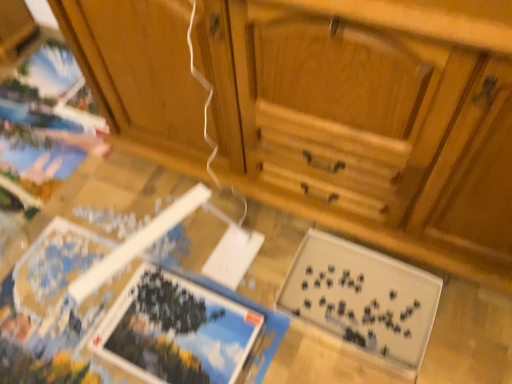
Question: From a real-world perspective, is black matte puzzle pieces at lower right, which ranks as the second magazine in left-to-right order, beneath wooden cabinet at center?

Choices:
 (A) yes
 (B) no

Answer: (A)

Question: Is black matte puzzle pieces at lower right, which ranks as the second magazine in left-to-right order, facing towards wooden cabinet at center?

Choices:
 (A) yes
 (B) no

Answer: (B)

Question: From the image's perspective, is black matte puzzle pieces at lower right, which is counted as the 1th magazine, starting from the right, on top of wooden cabinet at center?

Choices:
 (A) yes
 (B) no

Answer: (B)

Question: Can you confirm if black matte puzzle pieces at lower right, which ranks as the second magazine in left-to-right order, is smaller than wooden cabinet at center?

Choices:
 (A) yes
 (B) no

Answer: (A)

Question: Is black matte puzzle pieces at lower right, which ranks as the second magazine in left-to-right order, taller than wooden cabinet at center?

Choices:
 (A) yes
 (B) no

Answer: (B)

Question: Considering the positions of point (86, 206) and point (350, 137), is point (86, 206) closer or farther from the camera than point (350, 137)?

Choices:
 (A) closer
 (B) farther

Answer: (B)

Question: Based on their positions, is wooden puzzle pieces at lower center located to the left or right of wooden cabinet at center?

Choices:
 (A) right
 (B) left

Answer: (B)

Question: From their relative heights in the image, would you say wooden puzzle pieces at lower center is taller or shorter than wooden cabinet at center?

Choices:
 (A) short
 (B) tall

Answer: (A)

Question: From the image's perspective, is wooden puzzle pieces at lower center above or below wooden cabinet at center?

Choices:
 (A) below
 (B) above

Answer: (A)

Question: In the image, is wooden cabinet at center positioned in front of or behind black matte puzzle pieces at lower right, which ranks as the second magazine in left-to-right order?

Choices:
 (A) front
 (B) behind

Answer: (A)

Question: Is wooden cabinet at center wider or thinner than black matte puzzle pieces at lower right, which ranks as the second magazine in left-to-right order?

Choices:
 (A) wide
 (B) thin

Answer: (A)

Question: Considering the positions of wooden cabinet at center and black matte puzzle pieces at lower right, which is counted as the 1th magazine, starting from the right, in the image, is wooden cabinet at center taller or shorter than black matte puzzle pieces at lower right, which is counted as the 1th magazine, starting from the right,?

Choices:
 (A) tall
 (B) short

Answer: (A)

Question: Does point (94, 52) appear closer or farther from the camera than point (415, 347)?

Choices:
 (A) closer
 (B) farther

Answer: (B)

Question: Considering the positions of blue glossy puzzle piece at lower left, the 1th magazine in the left-to-right sequence, and black matte puzzle pieces at lower right, which is counted as the 1th magazine, starting from the right, in the image, is blue glossy puzzle piece at lower left, the 1th magazine in the left-to-right sequence, bigger or smaller than black matte puzzle pieces at lower right, which is counted as the 1th magazine, starting from the right,?

Choices:
 (A) small
 (B) big

Answer: (A)

Question: From a real-world perspective, is blue glossy puzzle piece at lower left, the 1th magazine in the left-to-right sequence, above or below black matte puzzle pieces at lower right, which is counted as the 1th magazine, starting from the right?

Choices:
 (A) below
 (B) above

Answer: (B)